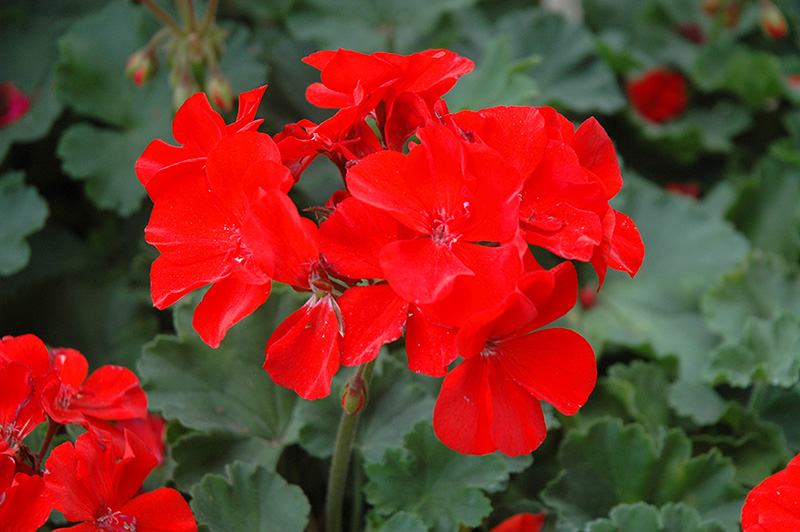
The image size is (800, 532). I want to click on hanging plant, so click(x=634, y=354).